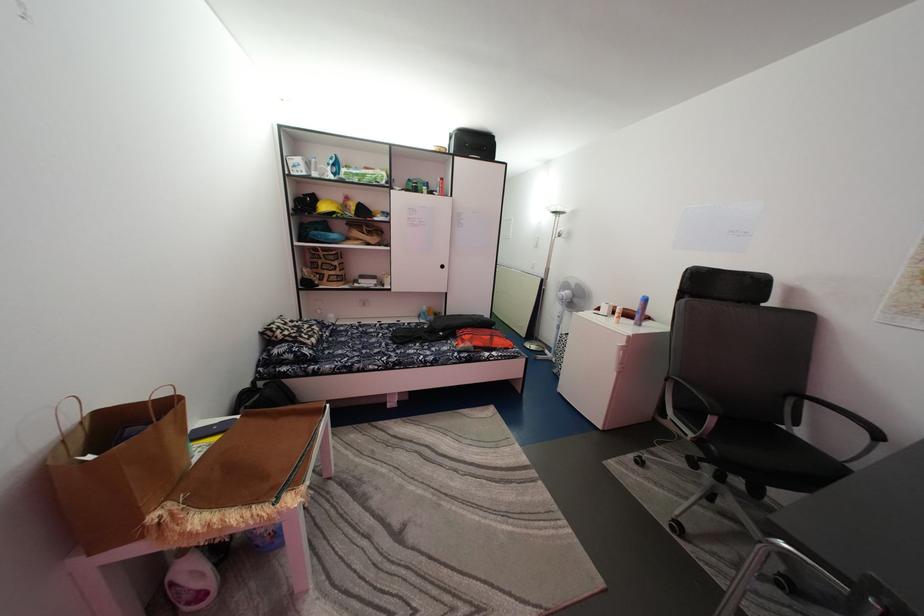
Locate an element on the screen. The width and height of the screenshot is (924, 616). detergent bottle handle is located at coordinates (640, 310).